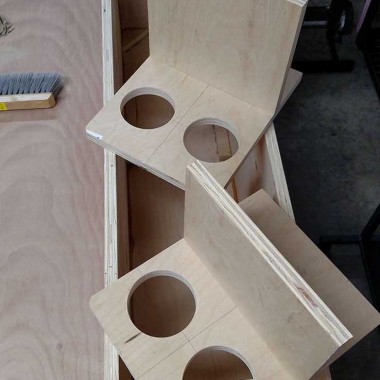
You are a GUI agent. You are given a task and a screenshot of the screen. Output one action in this format:
    pyautogui.click(x=<x>, y=<y>)
    Task: Click on the cupholder
    
    Given the screenshot: What is the action you would take?
    pyautogui.click(x=173, y=310), pyautogui.click(x=149, y=109), pyautogui.click(x=224, y=146), pyautogui.click(x=219, y=351)